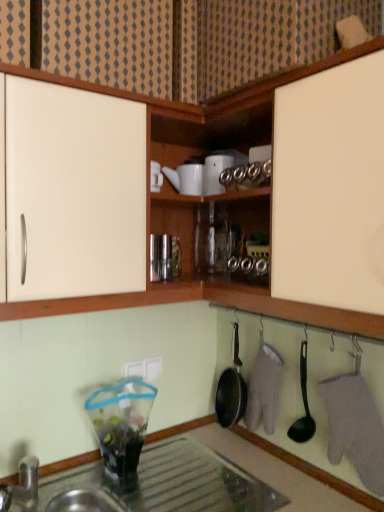
Question: Is white glossy teapot at upper center, the 4th appliance ordered from the bottom, oriented away from white plastic electric outlet at lower center?

Choices:
 (A) yes
 (B) no

Answer: (B)

Question: From a real-world perspective, is white glossy teapot at upper center, the 4th appliance ordered from the bottom, beneath white plastic electric outlet at lower center?

Choices:
 (A) yes
 (B) no

Answer: (B)

Question: Considering the relative sizes of white glossy teapot at upper center, the 4th appliance ordered from the bottom, and white plastic electric outlet at lower center in the image provided, is white glossy teapot at upper center, the 4th appliance ordered from the bottom, shorter than white plastic electric outlet at lower center?

Choices:
 (A) no
 (B) yes

Answer: (A)

Question: Does white glossy teapot at upper center, the 4th appliance ordered from the bottom, have a greater height compared to white plastic electric outlet at lower center?

Choices:
 (A) no
 (B) yes

Answer: (B)

Question: Is white glossy teapot at upper center, which ranks as the first appliance in top-to-bottom order, placed right next to white plastic electric outlet at lower center?

Choices:
 (A) no
 (B) yes

Answer: (A)

Question: Is white glossy teapot at upper center, which ranks as the first appliance in top-to-bottom order, wider or thinner than metallic glass jar at center, which is the third appliance in top-to-bottom order?

Choices:
 (A) wide
 (B) thin

Answer: (A)

Question: Is white glossy teapot at upper center, which ranks as the first appliance in top-to-bottom order, taller or shorter than metallic glass jar at center, which is the third appliance in top-to-bottom order?

Choices:
 (A) tall
 (B) short

Answer: (B)

Question: Based on their sizes in the image, would you say white glossy teapot at upper center, which ranks as the first appliance in top-to-bottom order, is bigger or smaller than metallic glass jar at center, which is the third appliance in top-to-bottom order?

Choices:
 (A) small
 (B) big

Answer: (B)

Question: From a real-world perspective, is white glossy teapot at upper center, the 4th appliance ordered from the bottom, physically located above or below metallic glass jar at center, which appears as the second appliance when ordered from the bottom?

Choices:
 (A) below
 (B) above

Answer: (B)

Question: In terms of height, does black plastic spoon at lower center look taller or shorter compared to white matte cabinet at upper center?

Choices:
 (A) short
 (B) tall

Answer: (A)

Question: Considering the positions of black plastic spoon at lower center and white matte cabinet at upper center in the image, is black plastic spoon at lower center wider or thinner than white matte cabinet at upper center?

Choices:
 (A) wide
 (B) thin

Answer: (B)

Question: Considering the positions of black plastic spoon at lower center and white matte cabinet at upper center in the image, is black plastic spoon at lower center bigger or smaller than white matte cabinet at upper center?

Choices:
 (A) small
 (B) big

Answer: (A)

Question: In the image, is black plastic spoon at lower center positioned in front of or behind white matte cabinet at upper center?

Choices:
 (A) front
 (B) behind

Answer: (B)

Question: From the image's perspective, is metallic glass jar at center, which appears as the second appliance when ordered from the bottom, above or below black plastic spoon at lower center?

Choices:
 (A) above
 (B) below

Answer: (A)

Question: In terms of height, does metallic glass jar at center, which is the third appliance in top-to-bottom order, look taller or shorter compared to black plastic spoon at lower center?

Choices:
 (A) tall
 (B) short

Answer: (B)